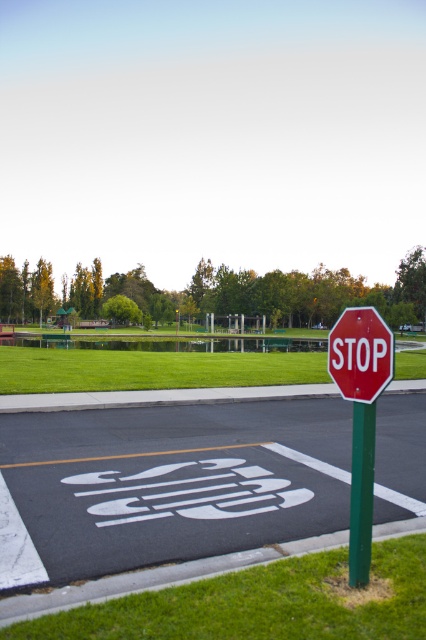
Question: Which of the following is the closest to the observer?

Choices:
 (A) (359, 579)
 (B) (20, 566)

Answer: (A)

Question: Which object is closer to the camera taking this photo?

Choices:
 (A) green metallic pole at right
 (B) green grass at center
 (C) white painted stop sign at center

Answer: (A)

Question: Can you confirm if white painted stop sign at center is positioned to the left of green grass at lower center?

Choices:
 (A) yes
 (B) no

Answer: (A)

Question: Estimate the real-world distances between objects in this image. Which object is closer to the red matte stop sign at center?

Choices:
 (A) green grass at lower center
 (B) green grass at center

Answer: (A)

Question: Observing the image, what is the correct spatial positioning of red matte stop sign at center in reference to green metallic pole at right?

Choices:
 (A) below
 (B) above

Answer: (B)

Question: Can you confirm if red matte stop sign at center is positioned to the right of green metallic pole at right?

Choices:
 (A) yes
 (B) no

Answer: (B)